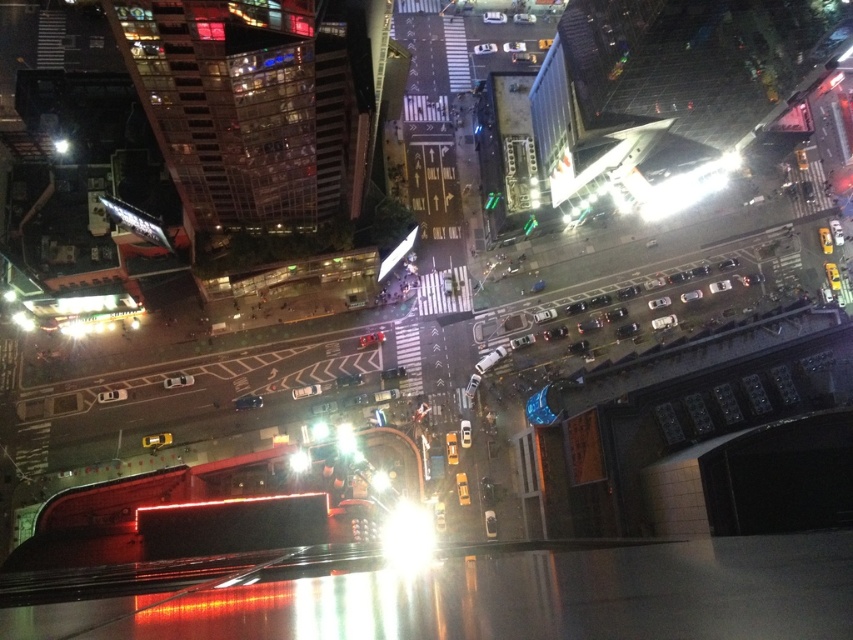
You are standing on the elevated platform and see the bright white light at center and the transparent glass light at center. Which light is closer to the ground?

The bright white light at center is positioned under the transparent glass light at center, so it is closer to the ground than the transparent glass light at center.

You are standing at the center of the image and see a bright white light at point (408, 536). Is this point closer to the foreground or the background of the image?

The point (408, 536) indicates a bright white light at center, so it is closer to the foreground than the background.